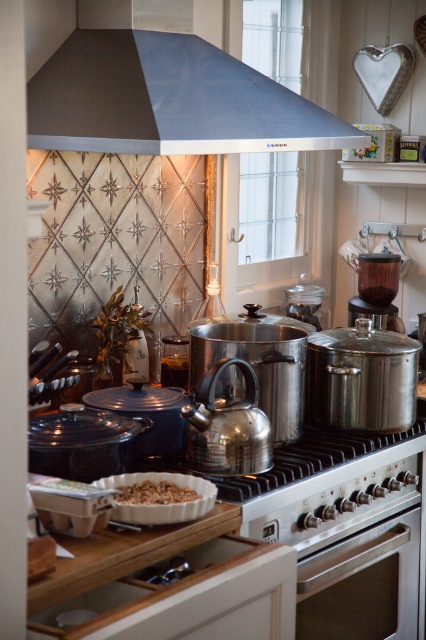
Who is taller, stainless steel oven at lower center or brown crumbly at center?

With more height is stainless steel oven at lower center.

Between stainless steel oven at lower center and brown crumbly at center, which one is positioned lower?

Positioned lower is stainless steel oven at lower center.

The image size is (426, 640). Find the location of `stainless steel oven at lower center`. stainless steel oven at lower center is located at coordinates (362, 584).

I want to click on stainless steel oven at lower center, so click(x=362, y=584).

Does satin steel exhaust hood at upper center appear on the right side of stainless steel oven at lower center?

Incorrect, satin steel exhaust hood at upper center is not on the right side of stainless steel oven at lower center.

Can you confirm if satin steel exhaust hood at upper center is shorter than stainless steel oven at lower center?

Yes, satin steel exhaust hood at upper center is shorter than stainless steel oven at lower center.

The image size is (426, 640). Find the location of `satin steel exhaust hood at upper center`. satin steel exhaust hood at upper center is located at coordinates (169, 100).

Between satin steel exhaust hood at upper center and brown crumbly at center, which one appears on the right side from the viewer's perspective?

Positioned to the right is satin steel exhaust hood at upper center.

Is satin steel exhaust hood at upper center positioned behind brown crumbly at center?

Yes, satin steel exhaust hood at upper center is further from the viewer.

The image size is (426, 640). What are the coordinates of `satin steel exhaust hood at upper center` in the screenshot? It's located at (169, 100).